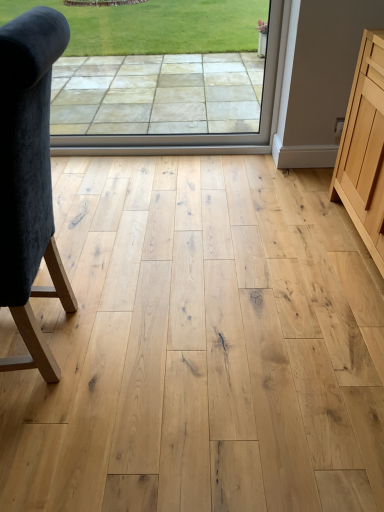
This screenshot has width=384, height=512. I want to click on free point below velvet dark blue chair at left (from a real-world perspective), so click(x=53, y=342).